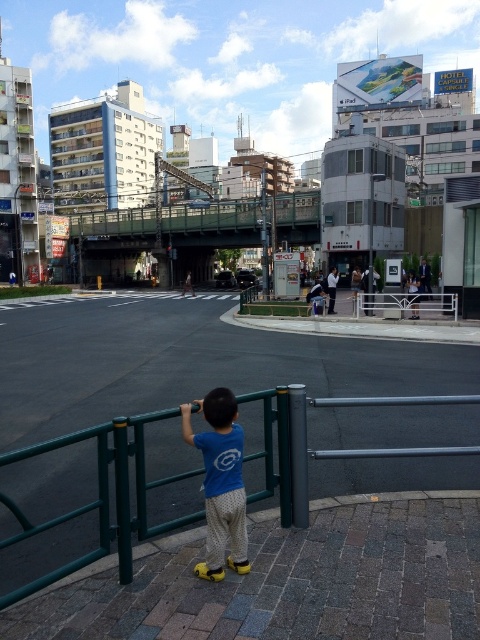
Locate an element on the screen. This screenshot has height=640, width=480. green metal fence at lower center is located at coordinates (101, 497).

Is green metal fence at lower center wider than blue cotton shirt at center?

Correct, the width of green metal fence at lower center exceeds that of blue cotton shirt at center.

At what (x,y) coordinates should I click in order to perform the action: click on green metal fence at lower center. Please return your answer as a coordinate pair (x, y). This screenshot has height=640, width=480. Looking at the image, I should click on (101, 497).